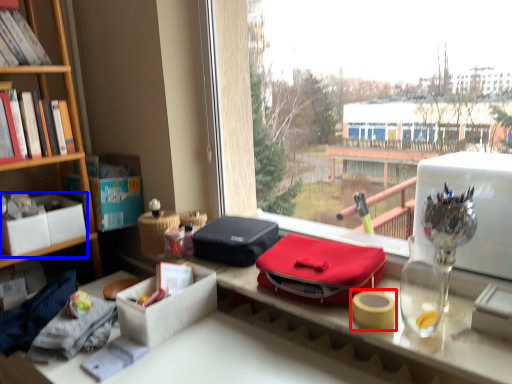
Question: Which of the following is the farthest to the observer, adhesive tape (highlighted by a red box) or box (highlighted by a blue box)?

Choices:
 (A) adhesive tape
 (B) box

Answer: (B)